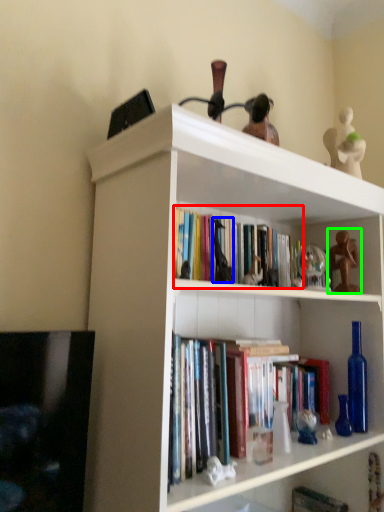
Question: Which is nearer to the book (highlighted by a red box)? toy (highlighted by a blue box) or toy (highlighted by a green box).

Choices:
 (A) toy
 (B) toy

Answer: (A)